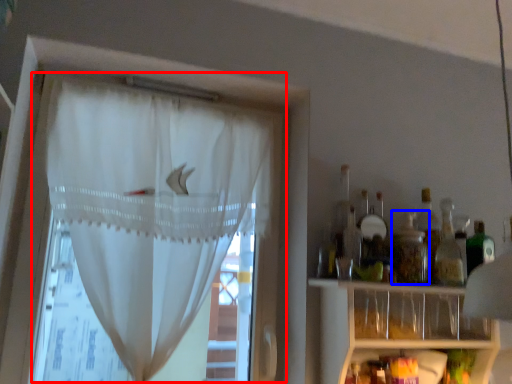
Question: Which object is further to the camera taking this photo, curtain (highlighted by a red box) or bottle (highlighted by a blue box)?

Choices:
 (A) curtain
 (B) bottle

Answer: (B)